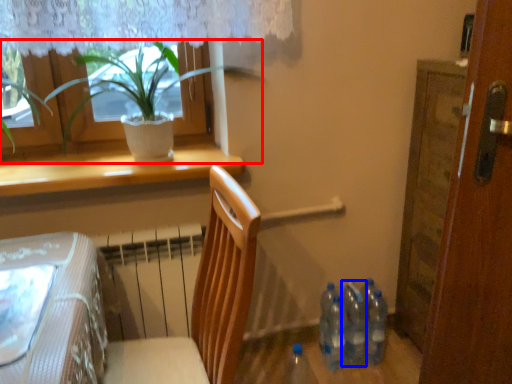
Question: Which object is further to the camera taking this photo, houseplant (highlighted by a red box) or bottle (highlighted by a blue box)?

Choices:
 (A) houseplant
 (B) bottle

Answer: (B)